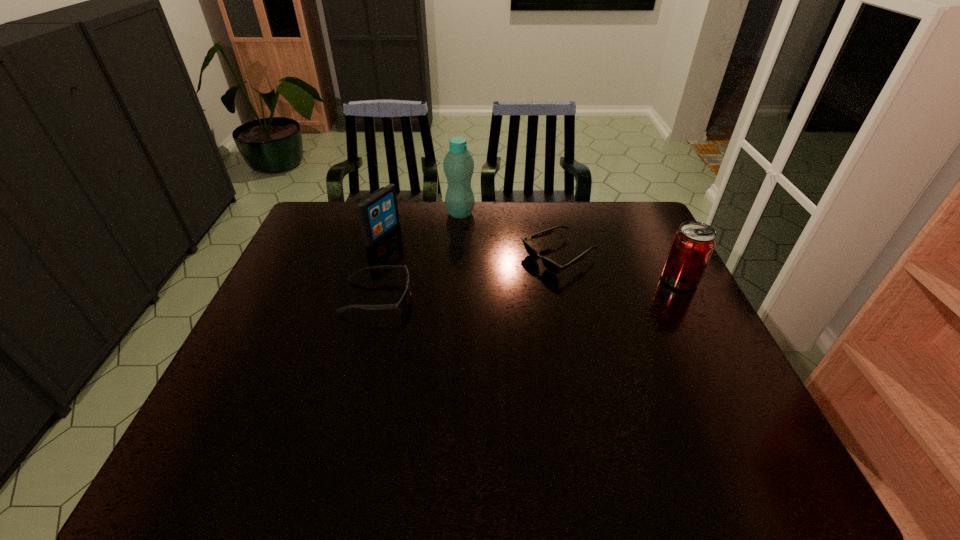
You are a GUI agent. You are given a task and a screenshot of the screen. Output one action in this format:
    pyautogui.click(x=<x>, y=<y>)
    Task: Click on the vacant spot on the desktop that is between the left sunglasses and the rightmost object and is positioned on the front-facing side of the right sunglasses
    This screenshot has height=540, width=960.
    Given the screenshot: What is the action you would take?
    pyautogui.click(x=492, y=291)

You are a GUI agent. You are given a task and a screenshot of the screen. Output one action in this format:
    pyautogui.click(x=<x>, y=<y>)
    Task: Click on the free space on the desktop that is between the left sunglasses and the pop soda and is positioned at the front cap of the water bottle
    Image resolution: width=960 pixels, height=540 pixels.
    Given the screenshot: What is the action you would take?
    pyautogui.click(x=501, y=291)

In order to click on free spot on the desktop that is between the left sunglasses and the pop soda and is positioned on the front screen of the third tallest object in this screenshot , I will do `click(517, 289)`.